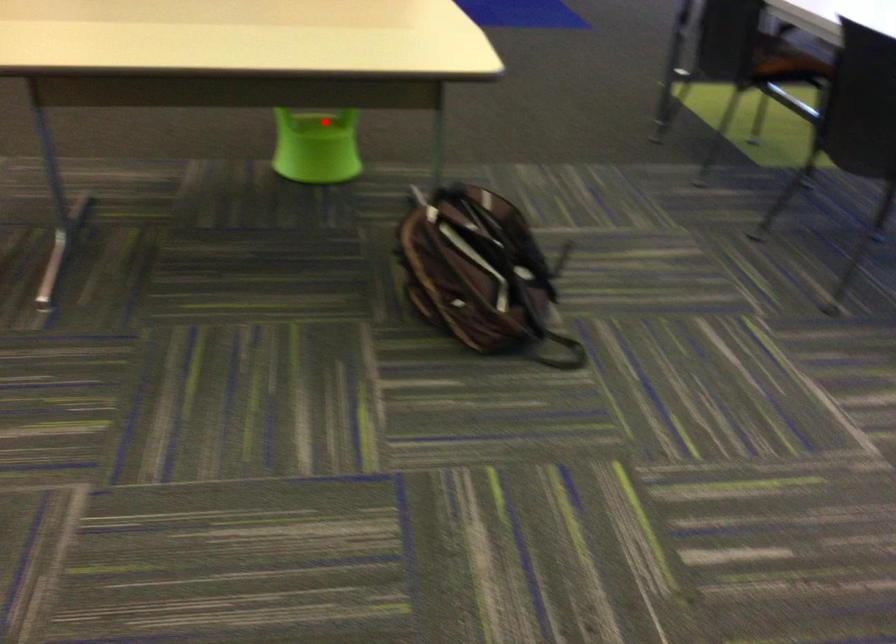
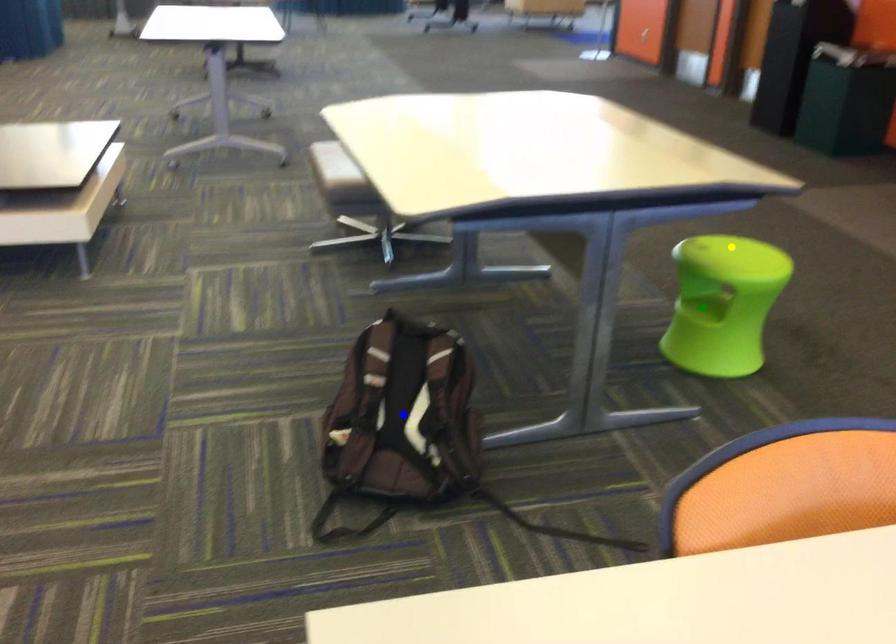
Question: I am providing you with two images of the same scene from different viewpoints. A red point is marked on the first image. You are given multiple points on the second image. Which spot in image 2 lines up with the point in image 1?

Choices:
 (A) green point
 (B) blue point
 (C) yellow point

Answer: (A)